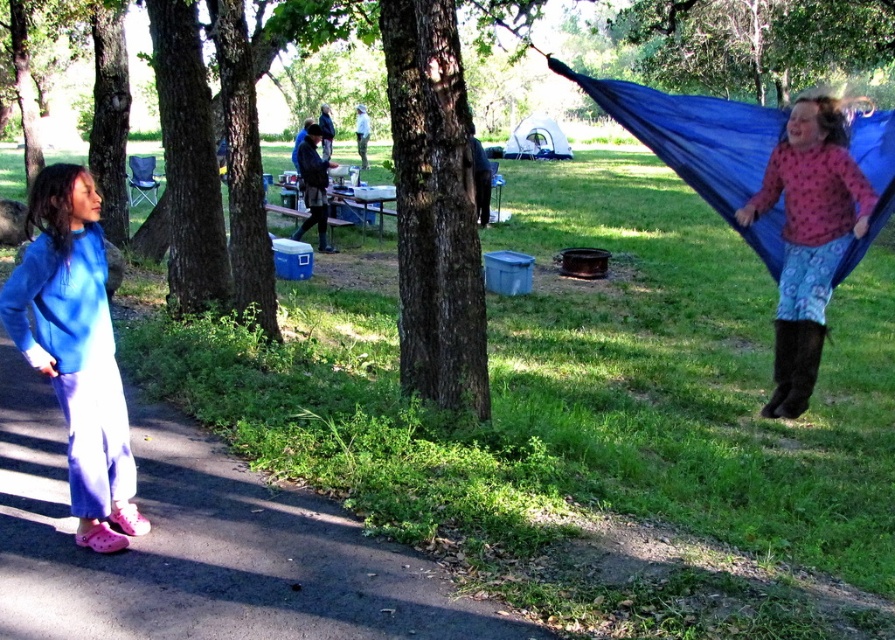
Question: Does blue fleece sweatshirt at left have a greater width compared to blue fabric hammock at right?

Choices:
 (A) no
 (B) yes

Answer: (A)

Question: Which object is positioned closest to the dark brown bark tree at center?

Choices:
 (A) blue fabric hammock at right
 (B) blue fleece sweatshirt at left

Answer: (A)

Question: Which object is the farthest from the dark brown bark tree at center?

Choices:
 (A) pink rubber shoes at lower left
 (B) pink dotted shirt at upper right

Answer: (B)

Question: Does pink rubber shoes at lower left have a smaller size compared to blue fleece sweatshirt at left?

Choices:
 (A) yes
 (B) no

Answer: (B)

Question: Among these points, which one is farthest from the camera?

Choices:
 (A) (81, 506)
 (B) (829, 147)

Answer: (B)

Question: Does dark brown bark tree at center appear on the left side of blue fabric hammock at right?

Choices:
 (A) no
 (B) yes

Answer: (B)